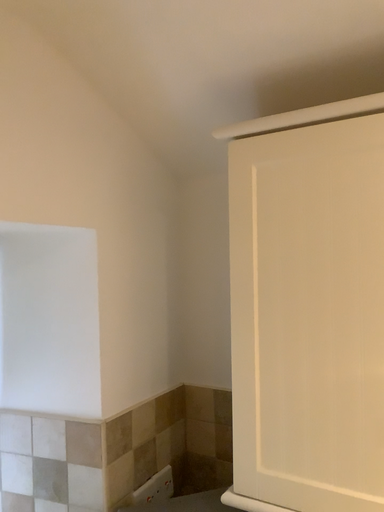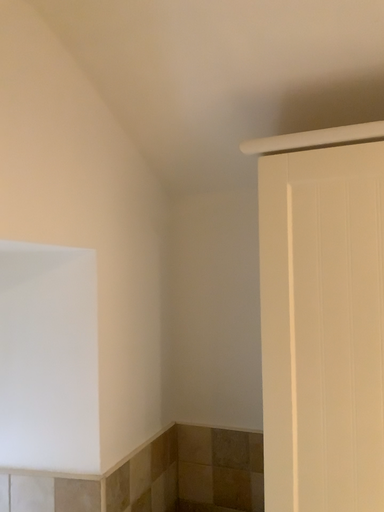
Question: How did the camera likely rotate when shooting the video?

Choices:
 (A) rotated right
 (B) rotated left

Answer: (A)